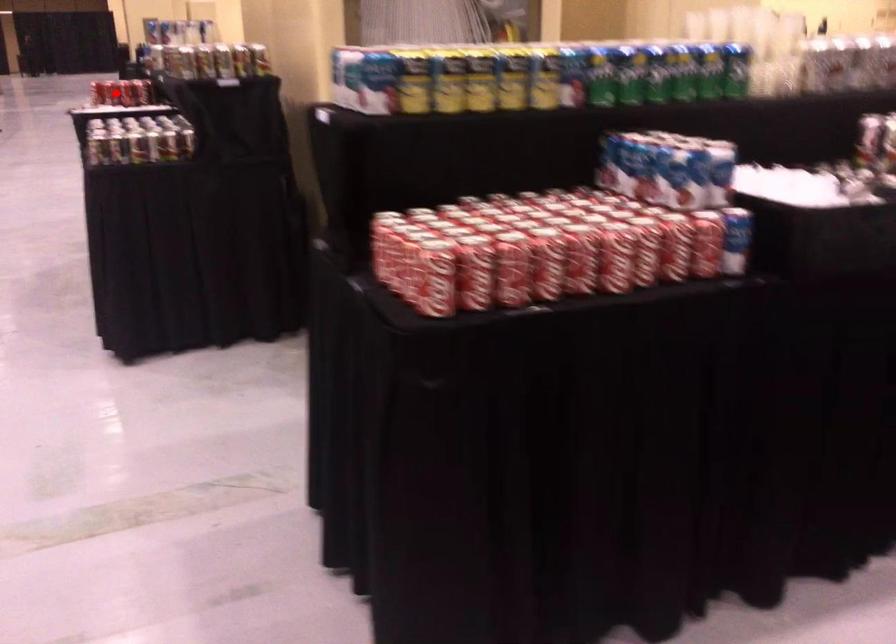
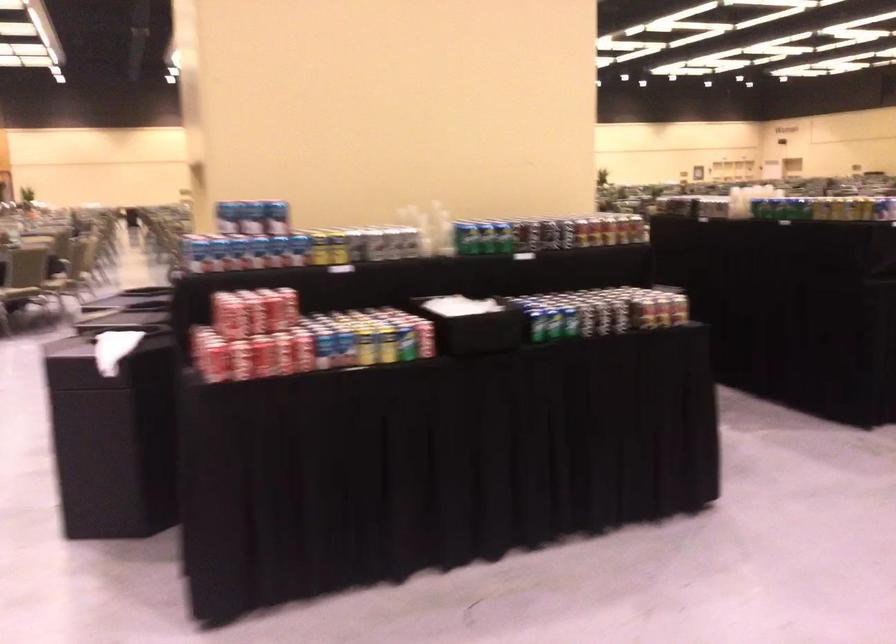
Question: I am providing you with two images of the same scene from different viewpoints. Image1 has a red point marked. In image2, the corresponding 3D location appears at what relative position? Reply with the corresponding letter.

Choices:
 (A) Closer
 (B) Farther

Answer: (A)